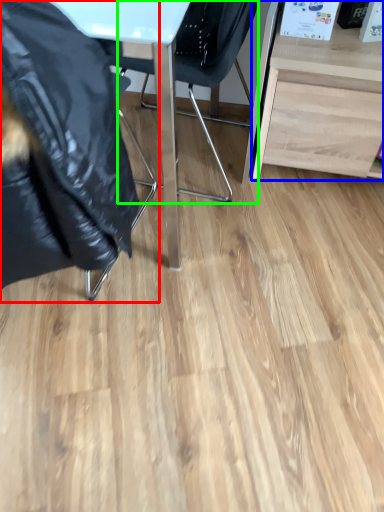
Question: Estimate the real-world distances between objects in this image. Which object is closer to chair (highlighted by a red box), desk (highlighted by a blue box) or chair (highlighted by a green box)?

Choices:
 (A) desk
 (B) chair

Answer: (B)